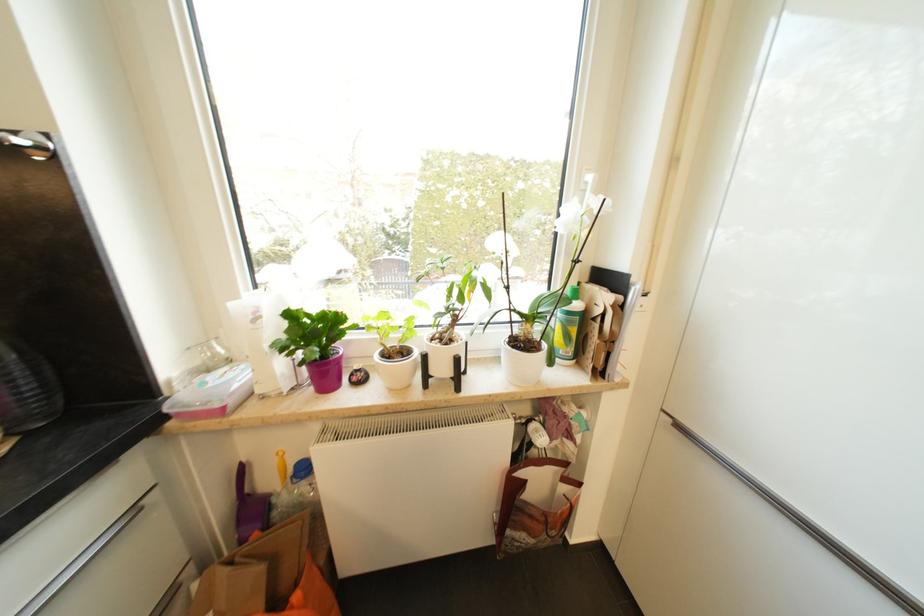
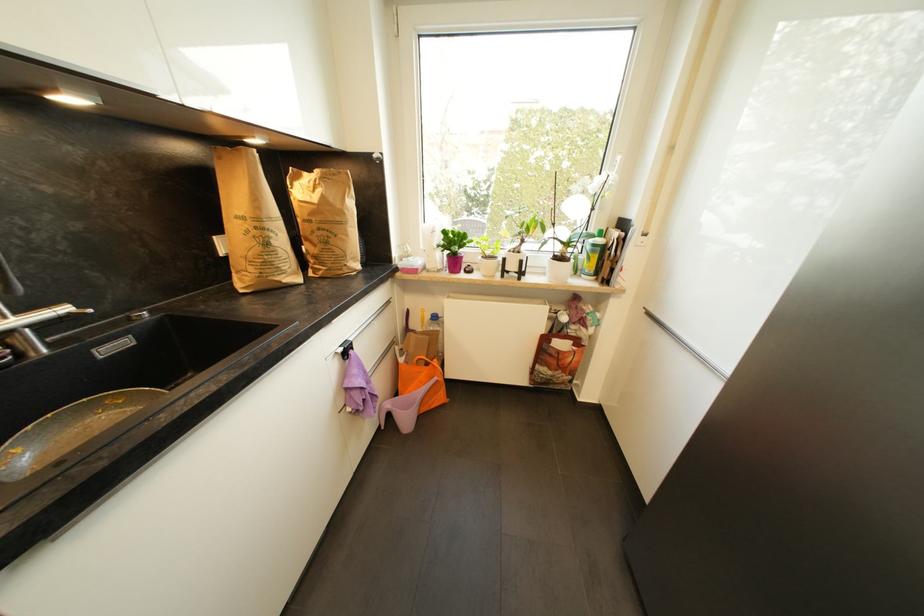
In the second image, find the point that corresponds to the point at 295,317 in the first image.

(450, 233)